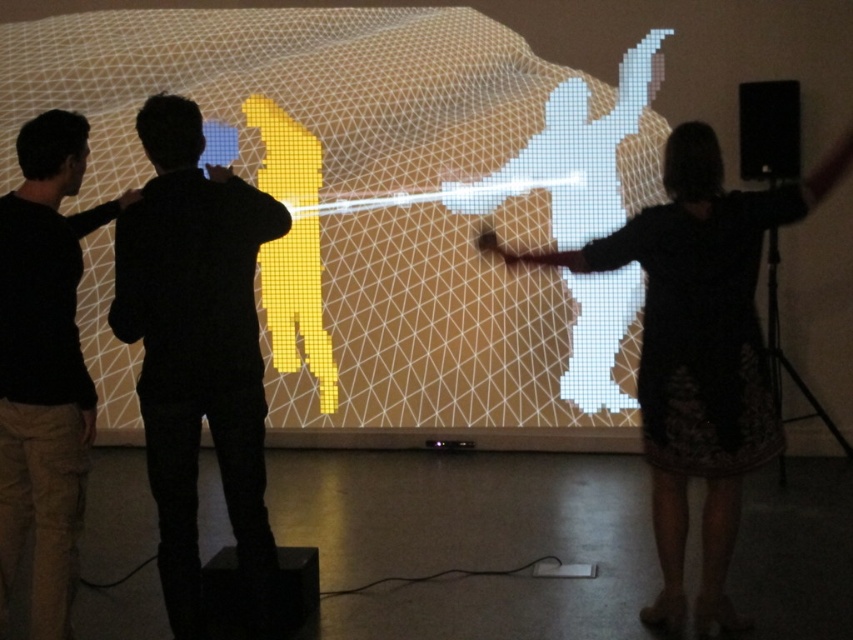
Question: Is black lace dress at center above black matte shirt at left?

Choices:
 (A) no
 (B) yes

Answer: (A)

Question: Among these objects, which one is farthest from the camera?

Choices:
 (A) black matte shirt at left
 (B) silhouette man at center

Answer: (A)

Question: Which of the following is the closest to the observer?

Choices:
 (A) (506, 372)
 (B) (671, 408)

Answer: (B)

Question: Is yellow pixelated figure at center positioned behind black matte shirt at left?

Choices:
 (A) no
 (B) yes

Answer: (B)

Question: Is yellow pixelated figure at center positioned at the back of black matte shirt at left?

Choices:
 (A) no
 (B) yes

Answer: (B)

Question: Which point is closer to the camera taking this photo?

Choices:
 (A) (422, 385)
 (B) (10, 429)

Answer: (B)